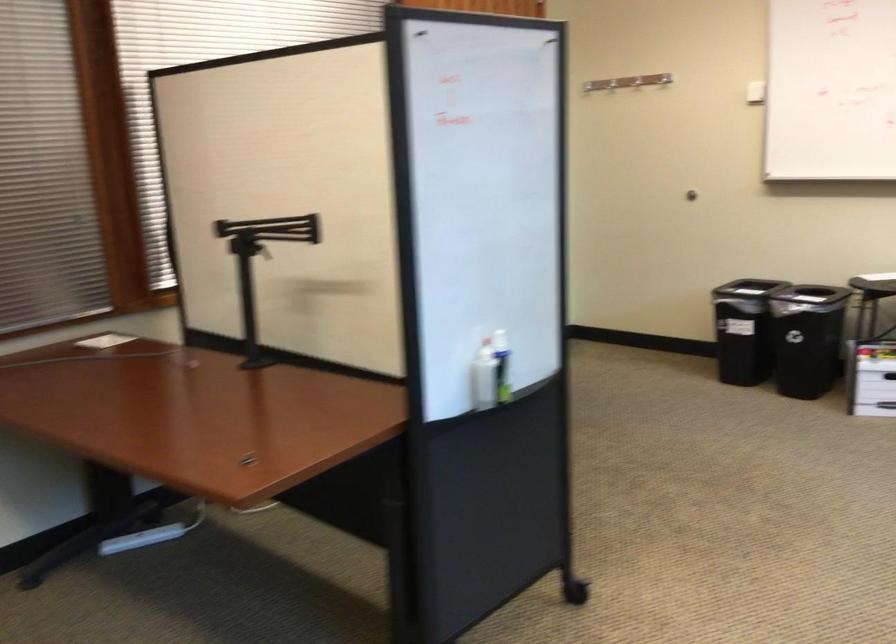
Locate an element on the screen. partition wheel is located at coordinates (575, 591).